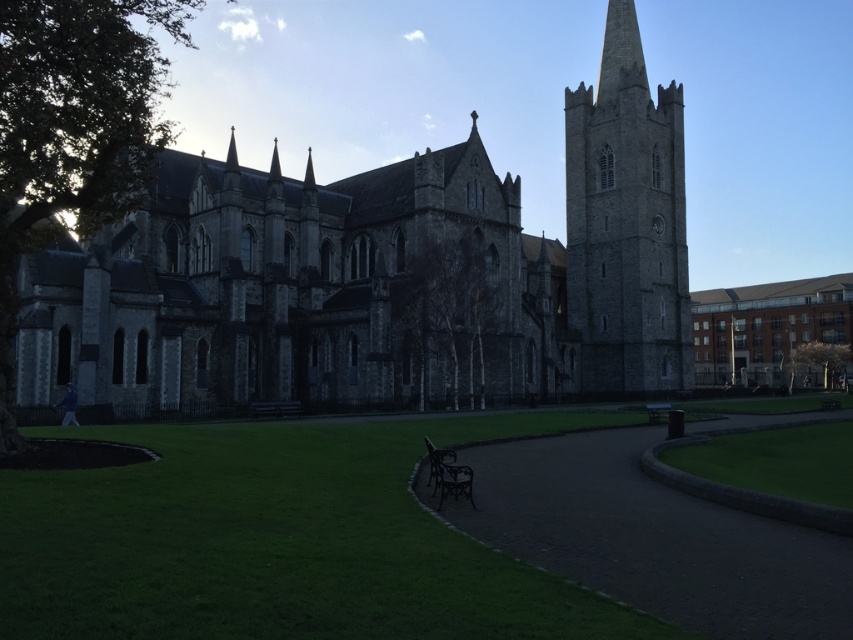
Question: Which point appears closest to the camera in this image?

Choices:
 (A) (624, 522)
 (B) (659, 404)
 (C) (442, 456)
 (D) (486, 157)

Answer: (A)

Question: Which of the following is the closest to the observer?

Choices:
 (A) wooden park bench at center
 (B) dark brown wooden bench at center

Answer: (B)

Question: Does dark brown wooden bench at center appear on the right side of wooden park bench at center?

Choices:
 (A) no
 (B) yes

Answer: (A)

Question: Is dark stone path at center to the left of gray stone tower at center from the viewer's perspective?

Choices:
 (A) no
 (B) yes

Answer: (B)

Question: Which object is positioned closest to the green grass at lower right?

Choices:
 (A) gray stone church at center
 (B) wooden park bench at center

Answer: (B)

Question: Is gray stone church at center thinner than gray stone tower at center?

Choices:
 (A) no
 (B) yes

Answer: (A)